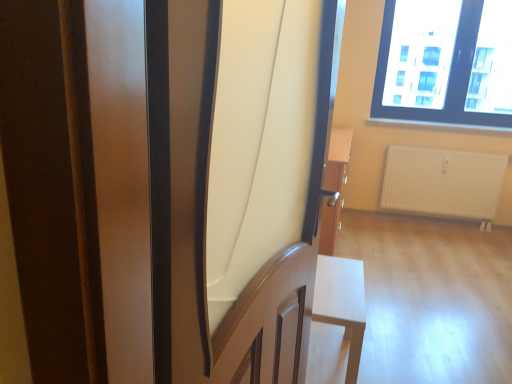
This screenshot has width=512, height=384. I want to click on free space that is to the left of white matte radiator at lower right, so click(388, 227).